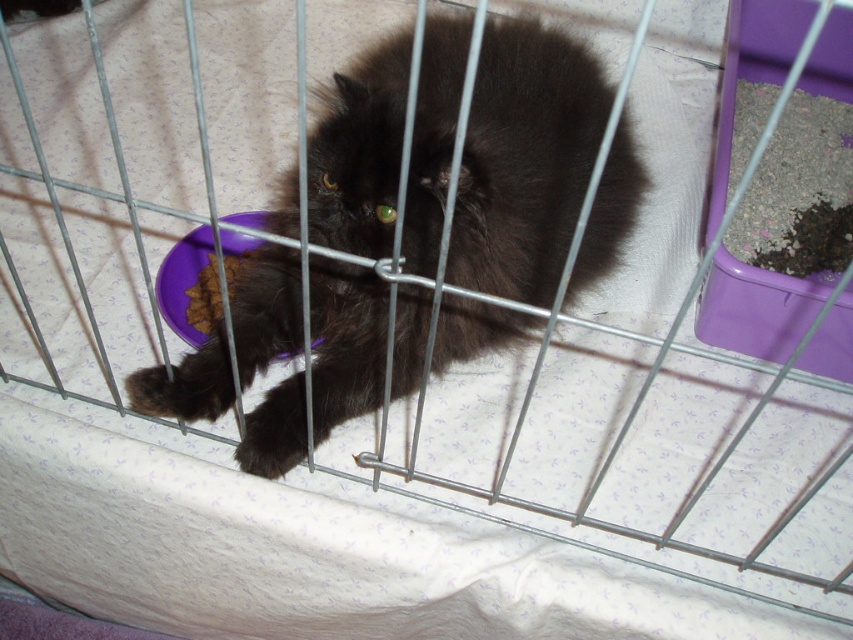
Which is behind, point (462, 76) or point (210, 278)?

Positioned behind is point (210, 278).

Can you confirm if fluffy black cat at center is positioned to the right of brown crumbly food at lower left?

Indeed, fluffy black cat at center is positioned on the right side of brown crumbly food at lower left.

At what (x,y) coordinates should I click in order to perform the action: click on fluffy black cat at center. Please return your answer as a coordinate pair (x, y). This screenshot has height=640, width=853. Looking at the image, I should click on (524, 161).

At what (x,y) coordinates should I click in order to perform the action: click on fluffy black cat at center. Please return your answer as a coordinate pair (x, y). The height and width of the screenshot is (640, 853). Looking at the image, I should click on (524, 161).